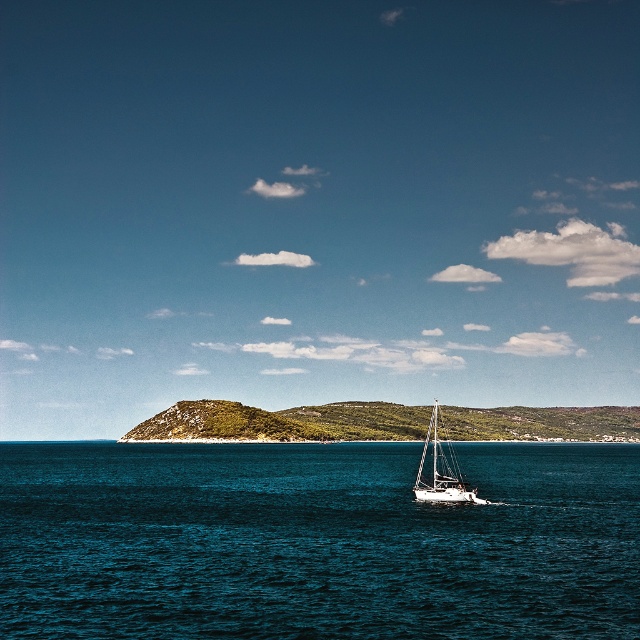
Can you confirm if deep blue water at center is wider than green grassy hill at center?

No, deep blue water at center is not wider than green grassy hill at center.

Does deep blue water at center have a lesser height compared to green grassy hill at center?

In fact, deep blue water at center may be taller than green grassy hill at center.

At what (x,y) coordinates should I click in order to perform the action: click on deep blue water at center. Please return your answer as a coordinate pair (x, y). The height and width of the screenshot is (640, 640). Looking at the image, I should click on [x=316, y=541].

This screenshot has width=640, height=640. Find the location of `deep blue water at center`. deep blue water at center is located at coordinates (316, 541).

Between point (458, 460) and point (435, 493), which one is positioned behind?

Positioned behind is point (458, 460).

Who is more forward, (524,449) or (436,500)?

Point (436,500)

Between point (189, 536) and point (467, 484), which one is positioned behind?

The point (467, 484) is behind.

This screenshot has width=640, height=640. What are the coordinates of `deep blue water at center` in the screenshot? It's located at (316, 541).

Does green grassy hill at center have a greater width compared to white glossy sailboat at center?

Yes, green grassy hill at center is wider than white glossy sailboat at center.

Describe the element at coordinates (284, 420) in the screenshot. The image size is (640, 640). I see `green grassy hill at center` at that location.

Find the location of a particular element. green grassy hill at center is located at coordinates (x=284, y=420).